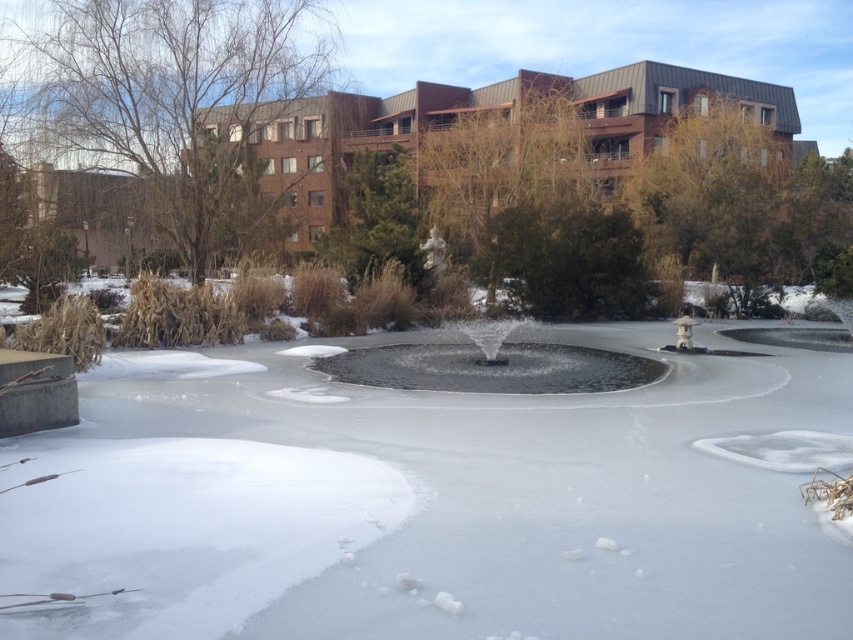
Does bare branches at upper left appear on the right side of green textured tree at center?

No, bare branches at upper left is not to the right of green textured tree at center.

Between bare branches at upper left and green textured tree at center, which one appears on the right side from the viewer's perspective?

Positioned to the right is green textured tree at center.

The image size is (853, 640). Describe the element at coordinates (167, 90) in the screenshot. I see `bare branches at upper left` at that location.

This screenshot has height=640, width=853. What are the coordinates of `bare branches at upper left` in the screenshot? It's located at (167, 90).

Which is above, brown textured tree at center or green textured tree at center?

brown textured tree at center

Who is more forward, (526,100) or (379,163)?

Point (379,163)

I want to click on brown textured tree at center, so click(x=502, y=164).

How distant is brown textured tree at center from brown textured tree at upper right?

brown textured tree at center is 18.78 feet from brown textured tree at upper right.

Is brown textured tree at center further to the viewer compared to brown textured tree at upper right?

No, brown textured tree at center is closer to the viewer.

This screenshot has height=640, width=853. Describe the element at coordinates (502, 164) in the screenshot. I see `brown textured tree at center` at that location.

Find the location of a particular element. Image resolution: width=853 pixels, height=640 pixels. brown textured tree at center is located at coordinates (502, 164).